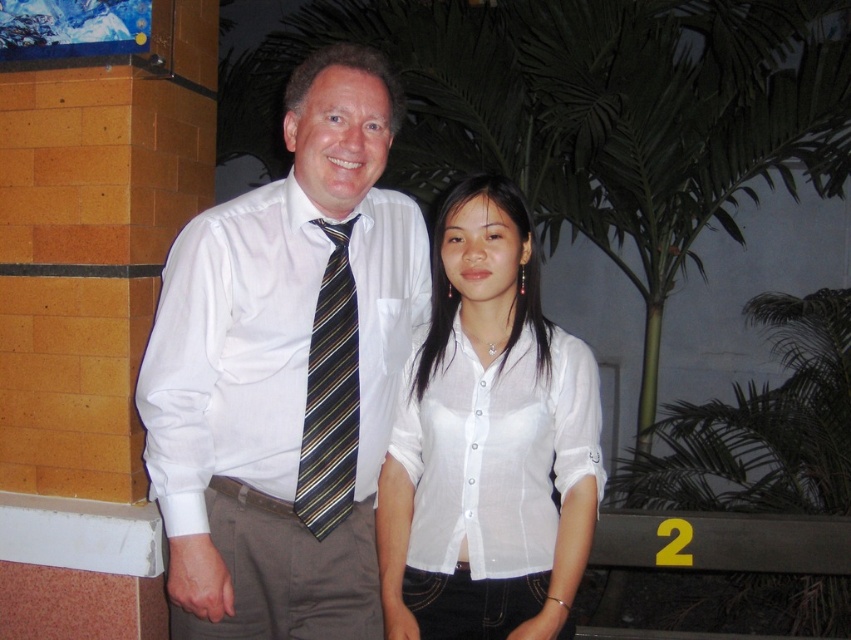
From the picture: Which of these two, white shirt at center or white sheer blouse at center, stands shorter?

white sheer blouse at center

Who is taller, white shirt at center or white sheer blouse at center?

With more height is white shirt at center.

Does point (223, 492) come in front of point (520, 228)?

Yes, point (223, 492) is in front of point (520, 228).

Find the location of `white shirt at center`. white shirt at center is located at coordinates (286, 372).

Between white shirt at center and striped fabric tie at center, which one has less height?

striped fabric tie at center

Does white shirt at center appear on the right side of striped fabric tie at center?

In fact, white shirt at center is to the left of striped fabric tie at center.

The image size is (851, 640). Describe the element at coordinates (286, 372) in the screenshot. I see `white shirt at center` at that location.

The width and height of the screenshot is (851, 640). In order to click on white shirt at center in this screenshot , I will do click(x=286, y=372).

Does white sheer blouse at center have a greater height compared to striped fabric tie at center?

Indeed, white sheer blouse at center has a greater height compared to striped fabric tie at center.

Between point (505, 595) and point (332, 416), which one is positioned behind?

Point (505, 595)

Locate an element on the screen. This screenshot has height=640, width=851. white sheer blouse at center is located at coordinates (489, 444).